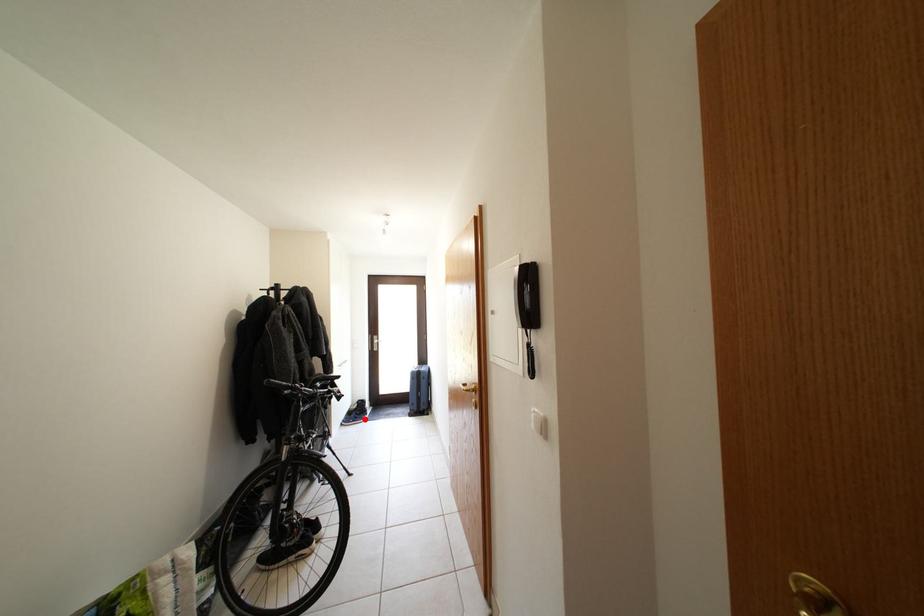
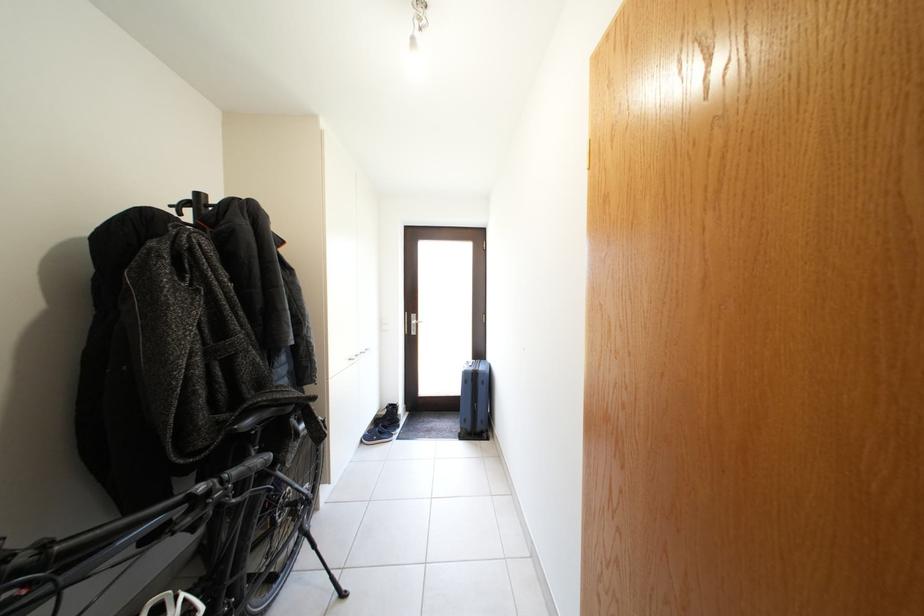
Where in the second image is the point corresponding to the highlighted location from the first image?

(392, 431)